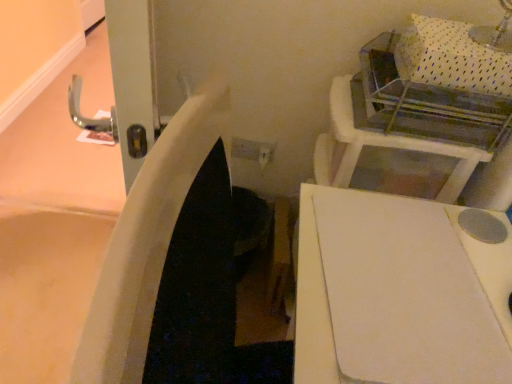
At what (x,y) coordinates should I click in order to perform the action: click on empty space that is ontop of white matte cutting board at center (from a real-world perspective). Please return your answer as a coordinate pair (x, y). This screenshot has height=384, width=512. Looking at the image, I should click on (407, 269).